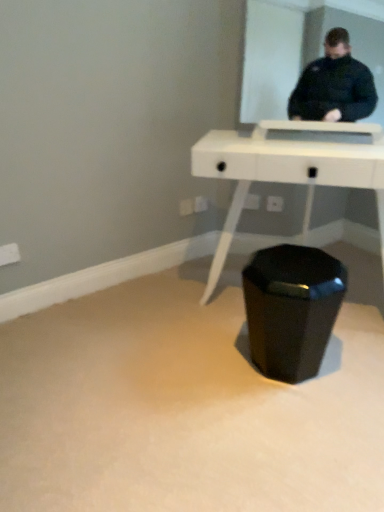
You are a GUI agent. You are given a task and a screenshot of the screen. Output one action in this format:
    pyautogui.click(x=<x>, y=<y>)
    Task: Click on the space that is in front of black glossy waste container at center
    
    Given the screenshot: What is the action you would take?
    pyautogui.click(x=297, y=419)